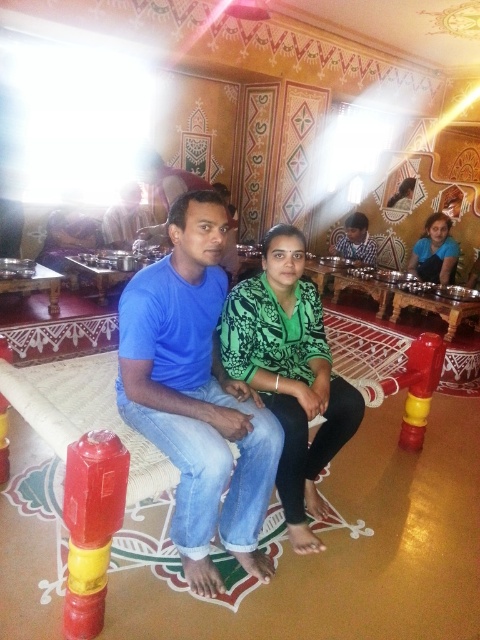
Question: Can you confirm if red/yellow plastic fire extinguisher at lower left is thinner than matte blue shirt at center?

Choices:
 (A) no
 (B) yes

Answer: (B)

Question: Which of the following is the farthest from the observer?

Choices:
 (A) blue cotton shirt at center
 (B) green printed shirt at center
 (C) red/yellow plastic fire extinguisher at lower left

Answer: (B)

Question: Which of these objects is positioned farthest from the red/yellow plastic fire extinguisher at lower left?

Choices:
 (A) green printed shirt at center
 (B) blue cotton shirt at center

Answer: (A)

Question: Is green printed shirt at center thinner than red/yellow plastic fire extinguisher at lower left?

Choices:
 (A) yes
 (B) no

Answer: (B)

Question: Where is green textured shirt at center located in relation to matte blue shirt at center in the image?

Choices:
 (A) above
 (B) below

Answer: (B)

Question: Which point appears closest to the camera in this image?

Choices:
 (A) (64, 520)
 (B) (251, 392)
 (C) (372, 257)
 (D) (247, 324)

Answer: (A)